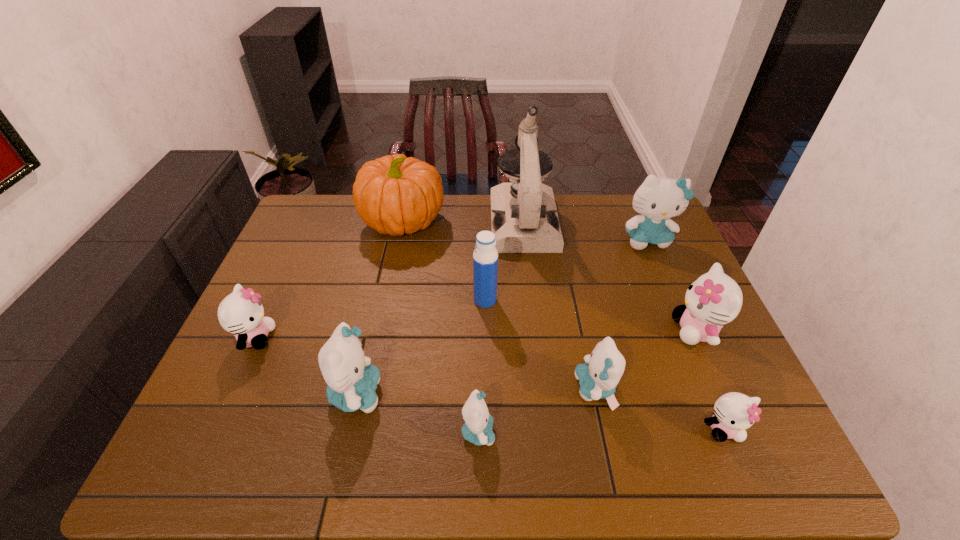
Image resolution: width=960 pixels, height=540 pixels. I want to click on vacant space located on the front-facing side of the biggest white kitten, so click(529, 330).

You are a GUI agent. You are given a task and a screenshot of the screen. Output one action in this format:
    pyautogui.click(x=<x>, y=<y>)
    Task: Click on the free space located 0.140m on the front-facing side of the biggest white kitten
    
    Given the screenshot: What is the action you would take?
    pyautogui.click(x=620, y=330)

This screenshot has width=960, height=540. What are the coordinates of `vacant space located on the front-facing side of the biggest white kitten` in the screenshot? It's located at (646, 330).

Find the location of a particular element. The width and height of the screenshot is (960, 540). blank space located on the face of the second blue kitten from right to left is located at coordinates click(x=457, y=389).

The image size is (960, 540). What are the coordinates of `blank area located 0.180m on the face of the second blue kitten from right to left` in the screenshot? It's located at (499, 389).

Locate an element on the screen. vacant area situated 0.340m on the face of the second blue kitten from right to left is located at coordinates (431, 389).

At what (x,y) coordinates should I click in order to perform the action: click on vacant space located 0.050m on the front-facing side of the leftmost kitten. Please return your answer as a coordinate pair (x, y). This screenshot has height=540, width=960. Looking at the image, I should click on (294, 338).

Where is `vacant space located on the face of the fifth kitten from right to left`? The width and height of the screenshot is (960, 540). vacant space located on the face of the fifth kitten from right to left is located at coordinates pyautogui.click(x=613, y=432).

Image resolution: width=960 pixels, height=540 pixels. Identify the location of microscope that is at the far edge. (524, 218).

The image size is (960, 540). What are the coordinates of `pumpkin present at the far edge` in the screenshot? It's located at (394, 194).